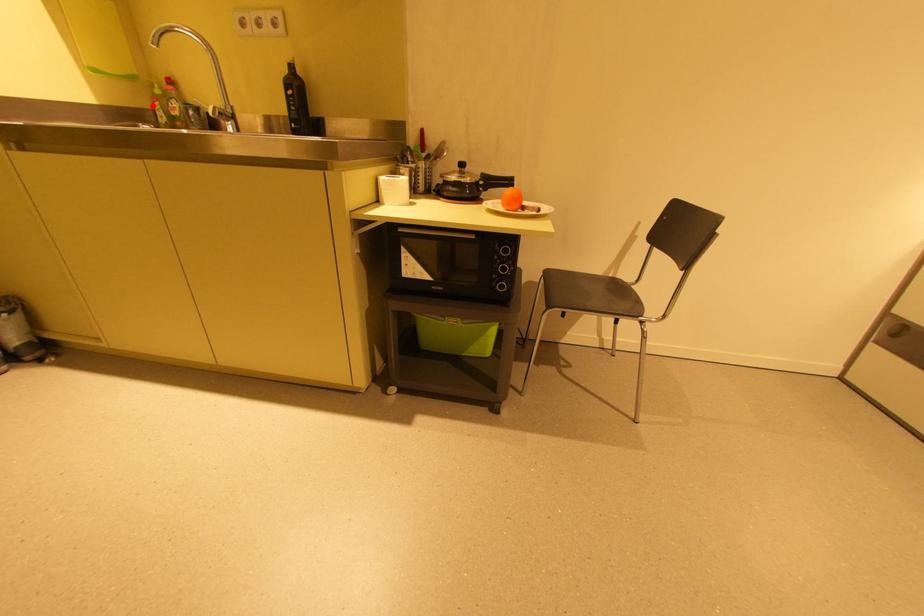
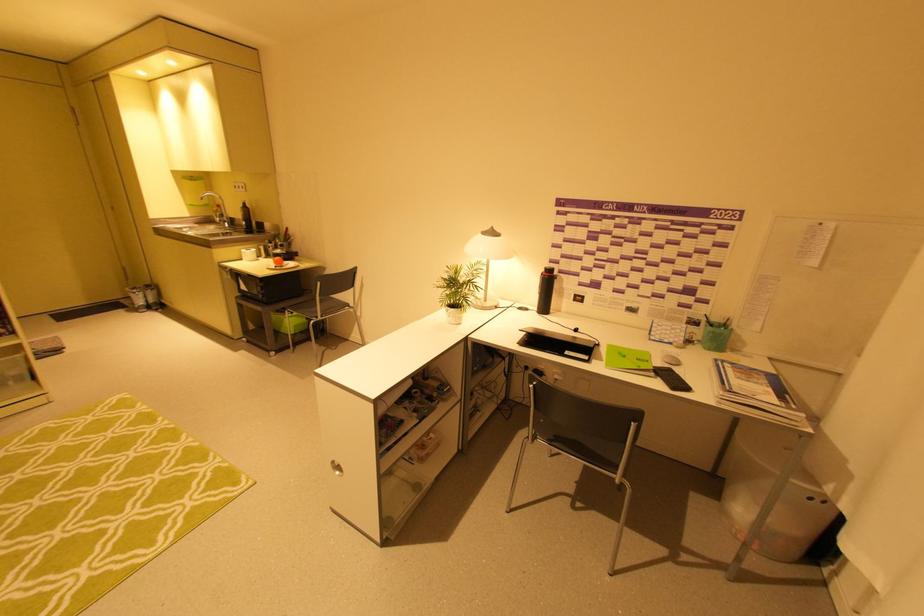
In the second image, find the point that corresponds to the highlighted location in the first image.

(215, 215)